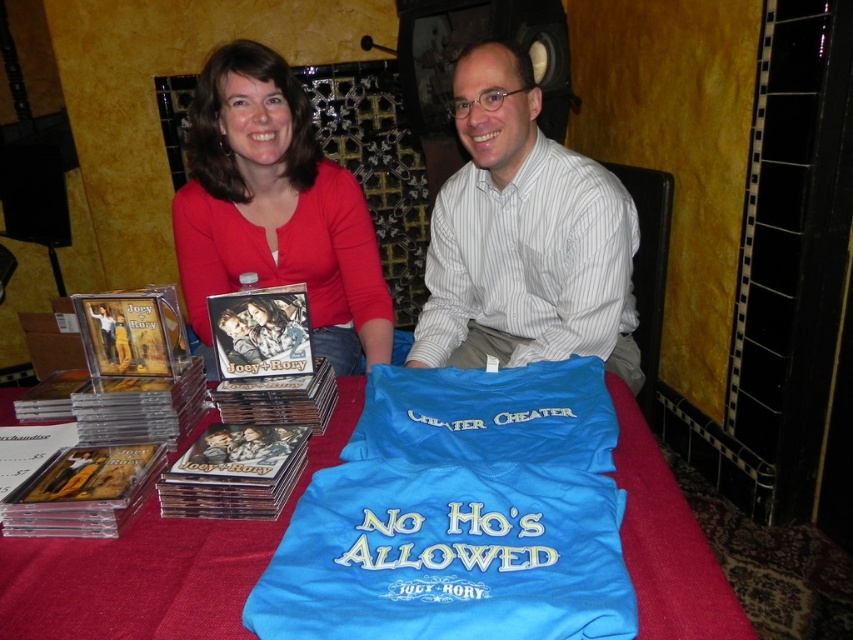
Question: Which point is closer to the camera taking this photo?

Choices:
 (A) (209, 234)
 (B) (715, 577)
 (C) (444, 355)

Answer: (B)

Question: Is white striped shirt at center further to camera compared to matte red shirt at upper left?

Choices:
 (A) no
 (B) yes

Answer: (A)

Question: Which object is the farthest from the white striped shirt at center?

Choices:
 (A) blue fabric table at center
 (B) matte red shirt at upper left

Answer: (A)

Question: Which point is closer to the camera taking this photo?

Choices:
 (A) click(x=552, y=198)
 (B) click(x=345, y=387)

Answer: (B)

Question: Is white striped shirt at center bigger than blue fabric table at center?

Choices:
 (A) yes
 (B) no

Answer: (A)

Question: Can you confirm if white striped shirt at center is wider than blue fabric table at center?

Choices:
 (A) no
 (B) yes

Answer: (B)